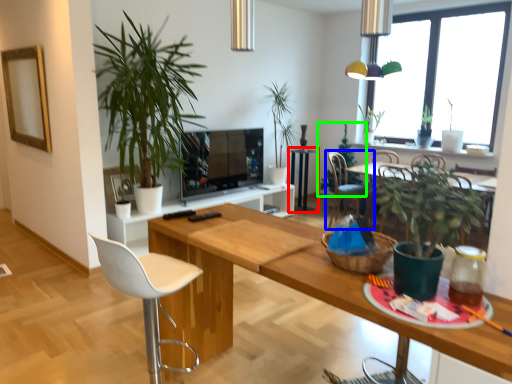
Question: Based on their relative distances, which object is nearer to side table (highlighted by a red box)? Choose from chair (highlighted by a blue box) and houseplant (highlighted by a green box).

Choices:
 (A) chair
 (B) houseplant

Answer: (A)